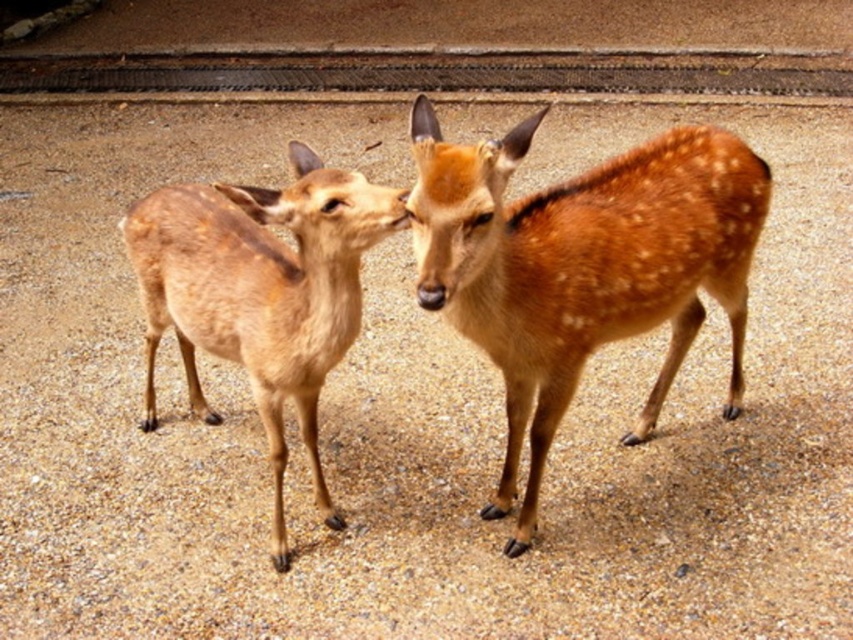
You are a wildlife photographer aiming to capture both the sandy brown fur at center and the brown speckled fur at center in a single frame. Based on their positions, which deer should you focus on first to ensure both are in the shot?

The sandy brown fur at center is to the right of brown speckled fur at center. To capture both in a single frame, focus on the brown speckled fur at center first, as it is positioned to the left, allowing the sandy brown fur at center to naturally fall into the frame when adjusting the camera angle.

You are a wildlife photographer trying to capture a photo of the two deer. You need to know which deer has a taller fur height between the sandy brown fur at center and the brown speckled fur at center. Which one should you focus on?

The sandy brown fur at center is much taller than the brown speckled fur at center, so you should focus on the sandy brown fur at center to capture the taller fur height.